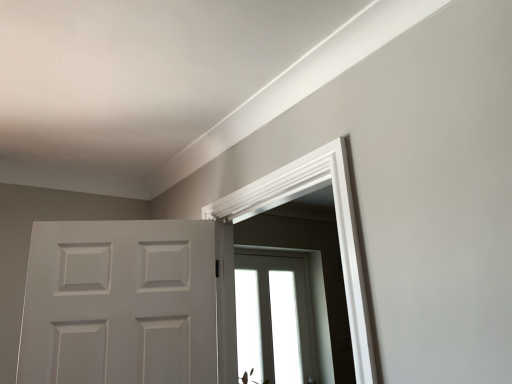
Question: Is transparent glass window at center taller or shorter than white smooth door frame at upper center?

Choices:
 (A) short
 (B) tall

Answer: (B)

Question: Considering the positions of transparent glass window at center and white smooth door frame at upper center in the image, is transparent glass window at center wider or thinner than white smooth door frame at upper center?

Choices:
 (A) wide
 (B) thin

Answer: (B)

Question: Which object is positioned farthest from the white matte door at center?

Choices:
 (A) transparent glass window at center
 (B) white smooth door frame at upper center

Answer: (A)

Question: Which object is the farthest from the white smooth door frame at upper center?

Choices:
 (A) white matte door at center
 (B) transparent glass window at center

Answer: (B)